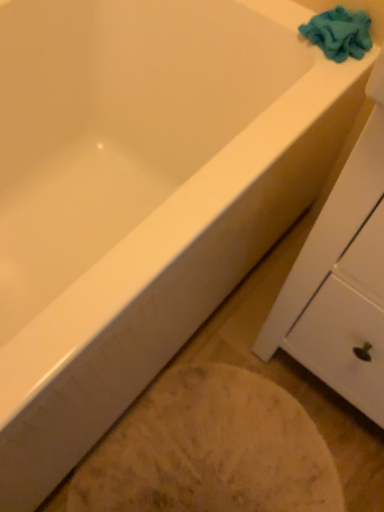
Question: Can you confirm if white glossy bathtub at lower left is bigger than blue fuzzy towel at upper right?

Choices:
 (A) no
 (B) yes

Answer: (B)

Question: Is white glossy bathtub at lower left far from blue fuzzy towel at upper right?

Choices:
 (A) yes
 (B) no

Answer: (B)

Question: Can you confirm if white glossy bathtub at lower left is positioned to the left of blue fuzzy towel at upper right?

Choices:
 (A) no
 (B) yes

Answer: (B)

Question: Is white glossy bathtub at lower left aimed at blue fuzzy towel at upper right?

Choices:
 (A) yes
 (B) no

Answer: (B)

Question: Considering the relative sizes of white glossy bathtub at lower left and blue fuzzy towel at upper right in the image provided, is white glossy bathtub at lower left shorter than blue fuzzy towel at upper right?

Choices:
 (A) no
 (B) yes

Answer: (B)

Question: Does white glossy bathtub at lower left have a lesser width compared to blue fuzzy towel at upper right?

Choices:
 (A) yes
 (B) no

Answer: (B)

Question: Considering the relative sizes of blue fuzzy towel at upper right and white glossy bathtub at lower left in the image provided, is blue fuzzy towel at upper right smaller than white glossy bathtub at lower left?

Choices:
 (A) no
 (B) yes

Answer: (B)

Question: Is blue fuzzy towel at upper right located outside white glossy bathtub at lower left?

Choices:
 (A) no
 (B) yes

Answer: (B)

Question: Is the surface of blue fuzzy towel at upper right in direct contact with white glossy bathtub at lower left?

Choices:
 (A) yes
 (B) no

Answer: (B)

Question: Is there a large distance between blue fuzzy towel at upper right and white glossy bathtub at lower left?

Choices:
 (A) yes
 (B) no

Answer: (B)

Question: Is blue fuzzy towel at upper right closer to the viewer compared to white glossy bathtub at lower left?

Choices:
 (A) no
 (B) yes

Answer: (A)

Question: Considering the relative sizes of blue fuzzy towel at upper right and white glossy bathtub at lower left in the image provided, is blue fuzzy towel at upper right shorter than white glossy bathtub at lower left?

Choices:
 (A) yes
 (B) no

Answer: (B)

Question: Considering the relative positions of white matte cabinet at upper right and white glossy bathtub at lower left in the image provided, is white matte cabinet at upper right to the left of white glossy bathtub at lower left from the viewer's perspective?

Choices:
 (A) no
 (B) yes

Answer: (A)